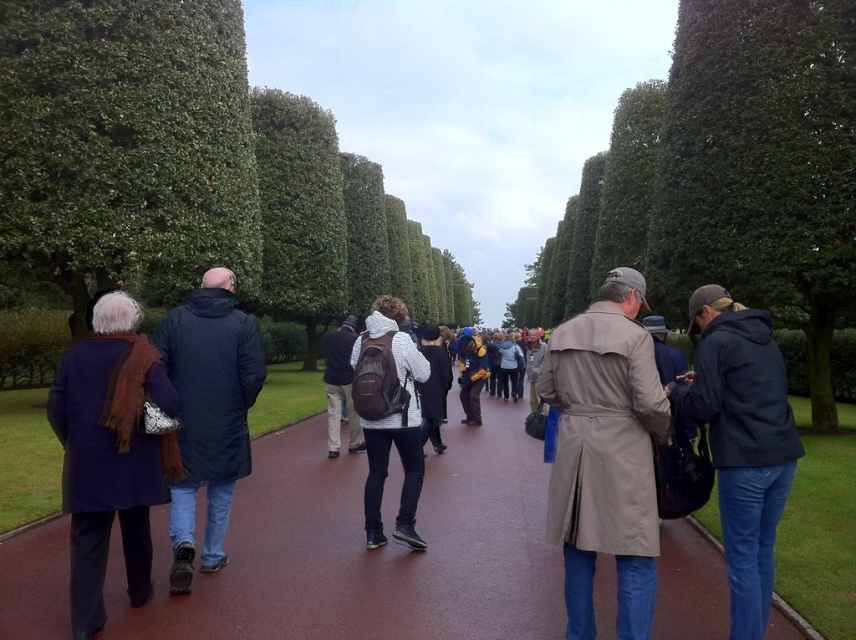
Question: Which point is farther to the camera?

Choices:
 (A) green leafy bush at center
 (B) dark blue coat at center
 (C) matte blue backpack at center
 (D) green leafy bush at left

Answer: (A)

Question: Is green leafy tree at center bigger than green leafy bush at left?

Choices:
 (A) yes
 (B) no

Answer: (A)

Question: Does brown asphalt at center have a smaller size compared to green leafy bush at center?

Choices:
 (A) yes
 (B) no

Answer: (A)

Question: Which point is closer to the camera?

Choices:
 (A) matte blue backpack at center
 (B) dark blue coat at center
 (C) brown asphalt at center

Answer: (C)

Question: Is tan leather trench coat at center positioned in front of matte brown backpack at center?

Choices:
 (A) no
 (B) yes

Answer: (B)

Question: Among these points, which one is nearest to the camera?

Choices:
 (A) (765, 38)
 (B) (132, 488)
 (C) (502, 492)
 (D) (626, 394)

Answer: (D)